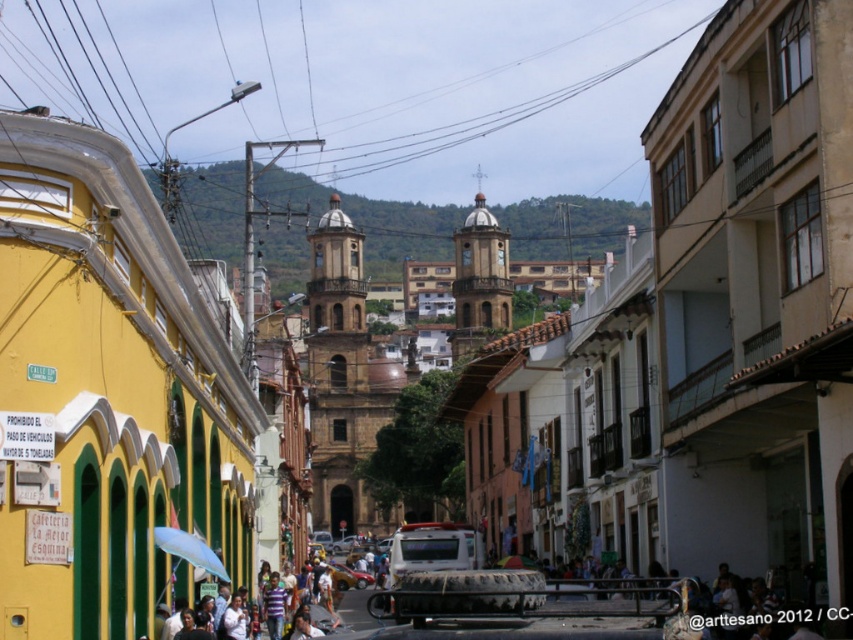
Between point (225, 579) and point (345, 568), which one is positioned in front?

Point (225, 579)

Does point (198, 540) come closer to viewer compared to point (351, 579)?

Yes, it is in front of point (351, 579).

This screenshot has width=853, height=640. I want to click on white matte umbrella at lower center, so click(x=189, y=548).